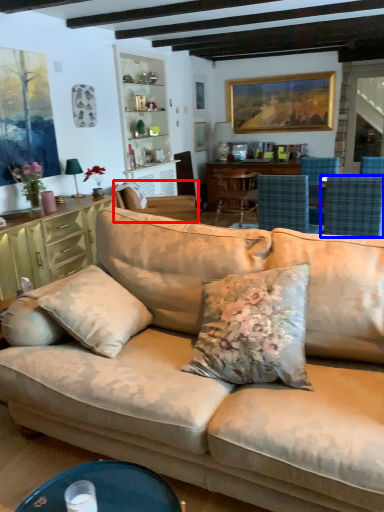
Question: Which point is closer to the camera, chair (highlighted by a red box) or chair (highlighted by a blue box)?

Choices:
 (A) chair
 (B) chair

Answer: (B)